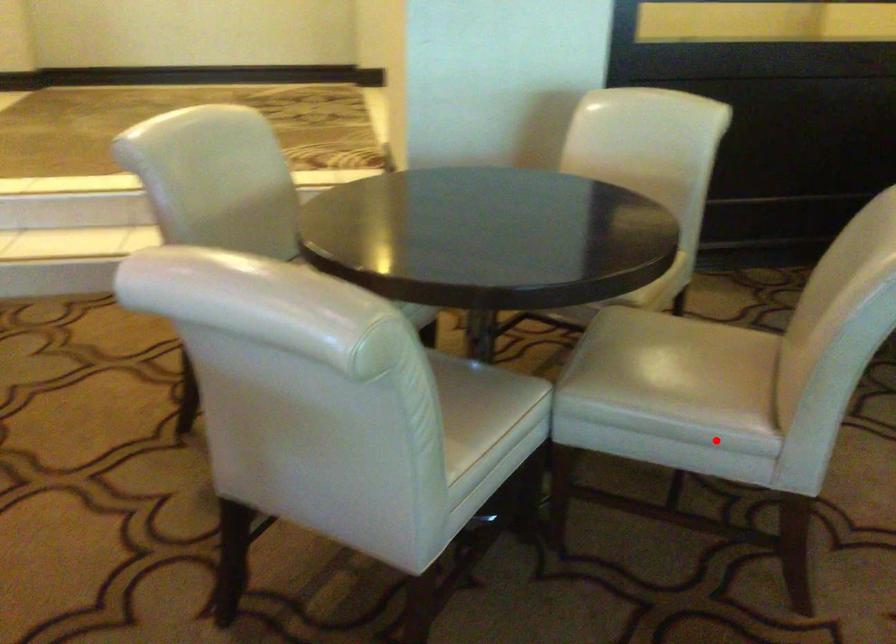
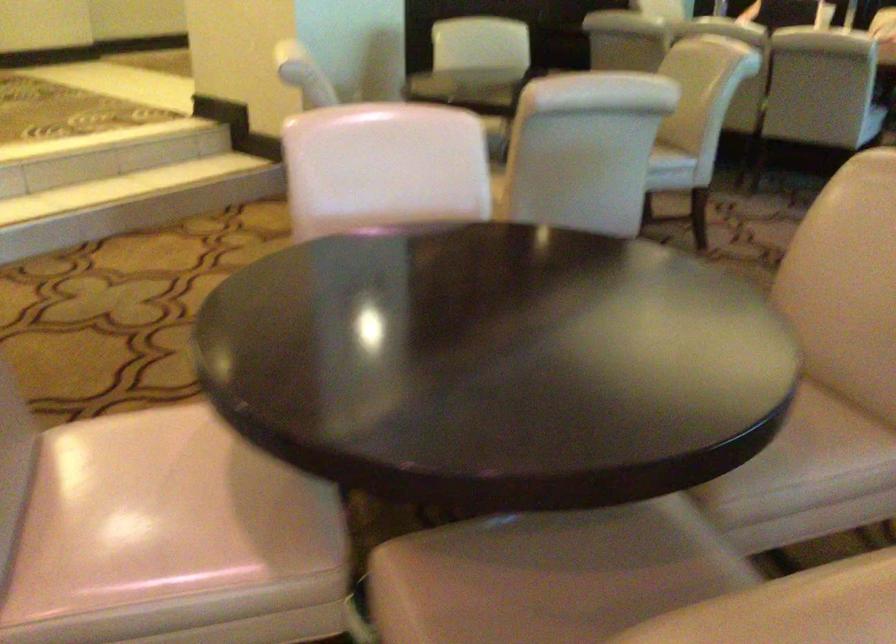
In the second image, find the point that corresponds to the highlighted location in the first image.

(670, 163)